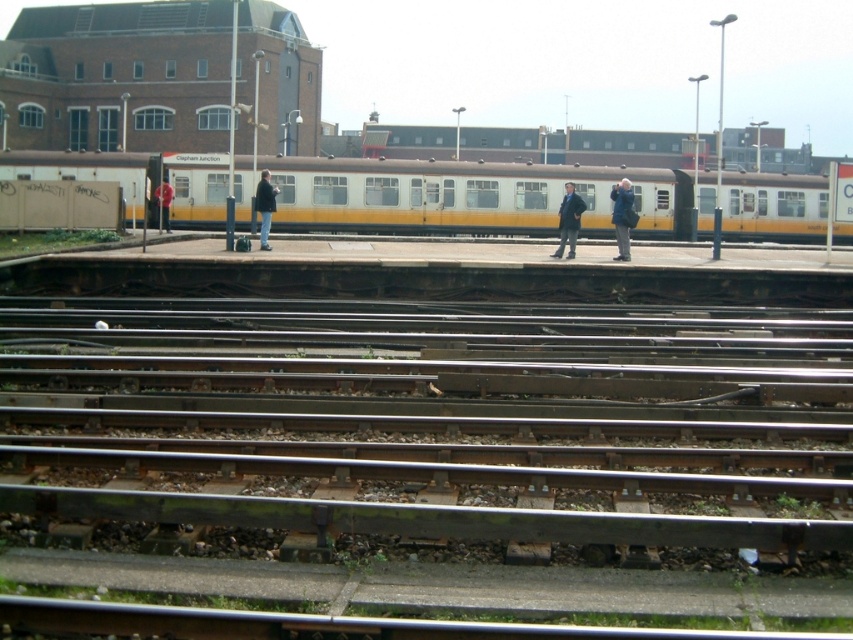
Question: Can you confirm if blue denim jacket at center is positioned to the right of dark blue jacket at center?

Choices:
 (A) no
 (B) yes

Answer: (B)

Question: Which object is positioned closest to the dark gray jacket at center?

Choices:
 (A) blue denim jacket at center
 (B) red fabric jacket at left
 (C) white/yellow painted passenger train at center

Answer: (B)

Question: Estimate the real-world distances between objects in this image. Which object is farther from the dark gray jacket at center?

Choices:
 (A) red fabric jacket at left
 (B) white/yellow painted passenger train at center

Answer: (B)

Question: In this image, where is dark blue jacket at center located relative to red fabric jacket at left?

Choices:
 (A) above
 (B) below

Answer: (B)

Question: Is the position of dark blue jacket at center more distant than that of dark gray jacket at center?

Choices:
 (A) yes
 (B) no

Answer: (B)

Question: Which point is closer to the camera?

Choices:
 (A) dark gray jacket at center
 (B) white/yellow painted passenger train at center
 (C) blue denim jacket at center

Answer: (C)